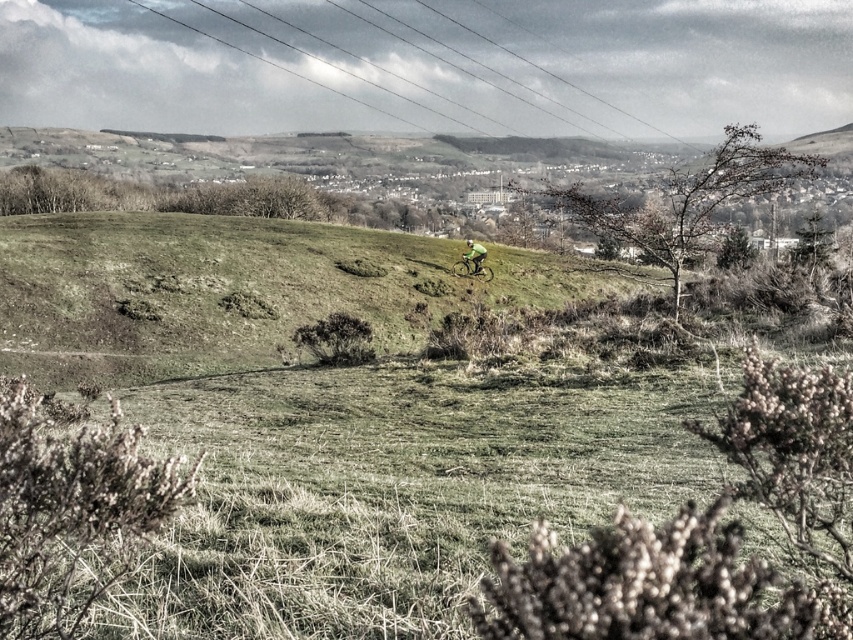
Is green matte mountain bike at center above green fabric bicycle at center?

Actually, green matte mountain bike at center is below green fabric bicycle at center.

Can you confirm if green matte mountain bike at center is bigger than green fabric bicycle at center?

Yes, green matte mountain bike at center is bigger than green fabric bicycle at center.

Does point (456, 273) come in front of point (467, 253)?

That is True.

Identify the location of green matte mountain bike at center. (473, 268).

Between metallic wires at upper center and green fabric bicycle at center, which one has less height?

Standing shorter between the two is green fabric bicycle at center.

Is metallic wires at upper center bigger than green fabric bicycle at center?

Yes.

Image resolution: width=853 pixels, height=640 pixels. I want to click on metallic wires at upper center, so click(x=270, y=61).

Is green fabric cyclist at center closer to the viewer compared to green fabric bicycle at center?

Yes, green fabric cyclist at center is in front of green fabric bicycle at center.

The height and width of the screenshot is (640, 853). What do you see at coordinates (238, 291) in the screenshot? I see `green fabric cyclist at center` at bounding box center [238, 291].

Does point (132, 332) lie behind point (469, 244)?

That is False.

At what (x,y) coordinates should I click in order to perform the action: click on green fabric cyclist at center. Please return your answer as a coordinate pair (x, y). Image resolution: width=853 pixels, height=640 pixels. Looking at the image, I should click on (238, 291).